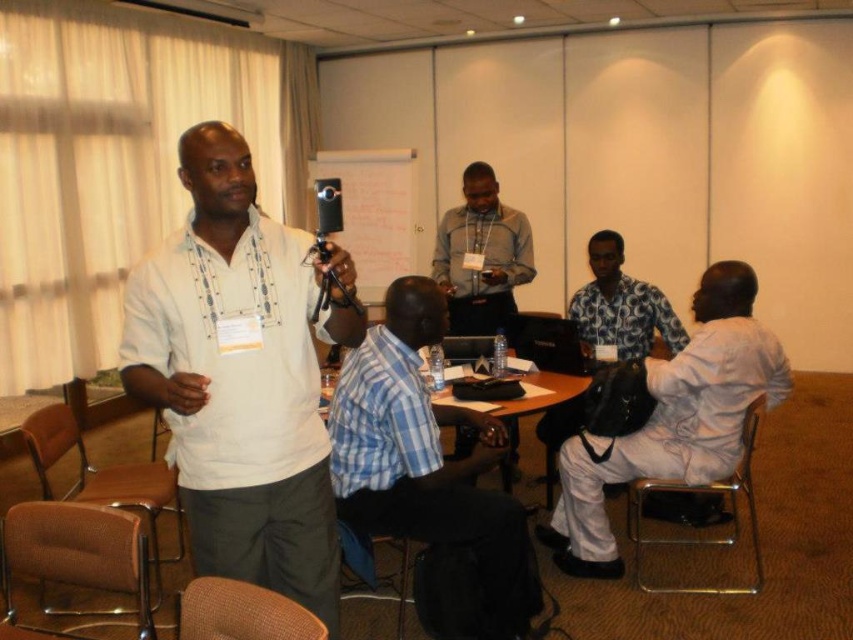
Between point (270, 579) and point (628, 308), which one is positioned in front?

Point (270, 579) is in front.

Is white matte shirt at center closer to camera compared to floral fabric shirt at center?

Yes.

Is point (178, 445) more distant than point (610, 320)?

No, it is in front of (610, 320).

This screenshot has width=853, height=640. Identify the location of white matte shirt at center. (242, 376).

Which is below, white matte shirt at center or white cotton shirt at center?

Positioned lower is white cotton shirt at center.

Is point (195, 282) closer to camera compared to point (579, 493)?

Yes, it is.

You are a GUI agent. You are given a task and a screenshot of the screen. Output one action in this format:
    pyautogui.click(x=<x>, y=<y>)
    Task: Click on the white matte shirt at center
    Image resolution: width=853 pixels, height=640 pixels.
    Given the screenshot: What is the action you would take?
    pyautogui.click(x=242, y=376)

Who is positioned more to the right, blue checkered shirt at center or white cotton shirt at center?

white cotton shirt at center is more to the right.

Between blue checkered shirt at center and white cotton shirt at center, which one has less height?

blue checkered shirt at center is shorter.

Identify the location of blue checkered shirt at center. This screenshot has width=853, height=640. (425, 458).